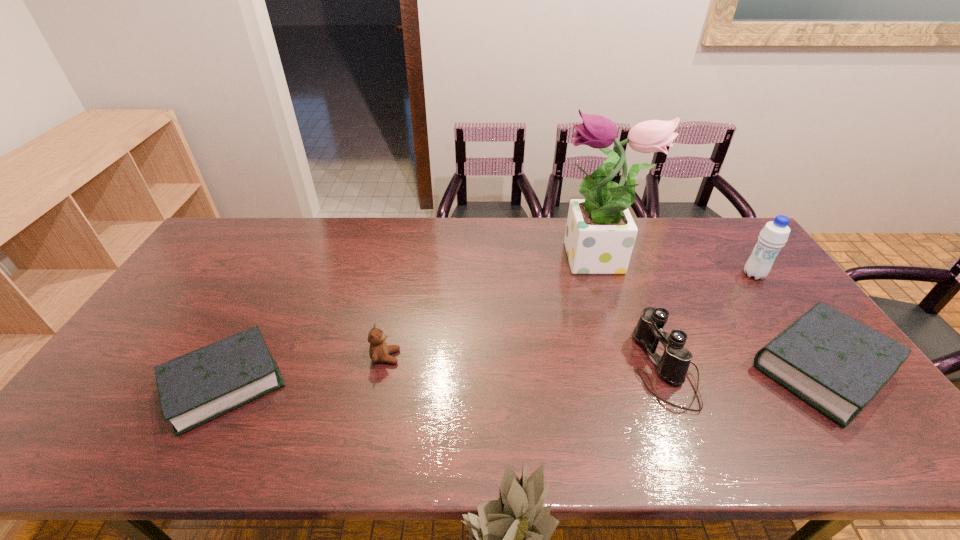
Find the location of a particular element. Bible that is at the right edge is located at coordinates (837, 364).

Identify the location of water bottle present at the right edge. The image size is (960, 540). (774, 235).

Identify the location of object present at the near left corner. Image resolution: width=960 pixels, height=540 pixels. (199, 386).

The height and width of the screenshot is (540, 960). Find the location of `object present at the near right corner`. object present at the near right corner is located at coordinates (837, 364).

Image resolution: width=960 pixels, height=540 pixels. In the image, there is a desktop. Identify the location of vacant space at the far edge. (560, 228).

The height and width of the screenshot is (540, 960). I want to click on vacant space at the near edge of the desktop, so click(520, 408).

In the image, there is a desktop. What are the coordinates of `free space at the left edge` in the screenshot? It's located at (211, 273).

Identify the location of free space at the right edge of the desktop. The width and height of the screenshot is (960, 540). (773, 274).

Where is `vacant area at the far left corner`? This screenshot has width=960, height=540. vacant area at the far left corner is located at coordinates (225, 223).

Identify the location of free space that is in between the water bottle and the leftmost object. (490, 329).